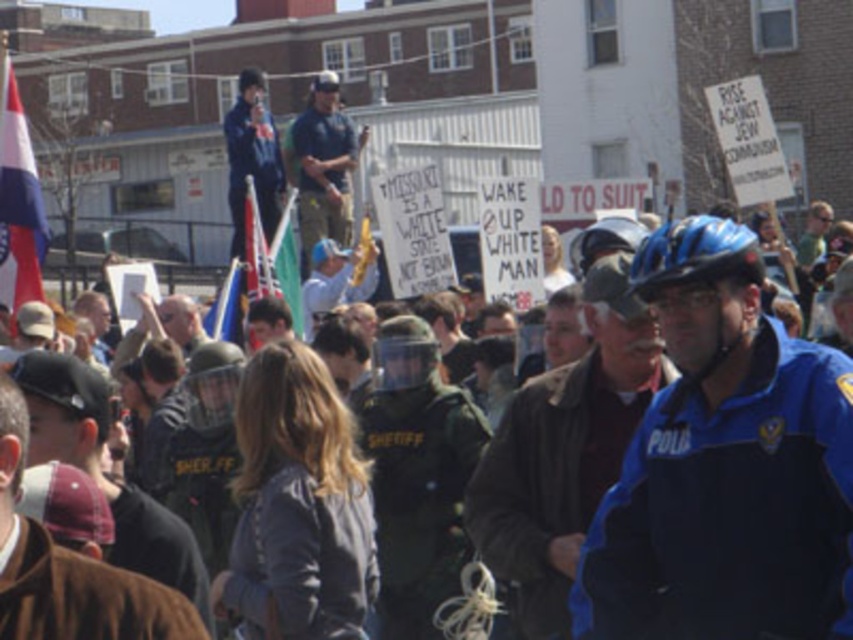
Is blue uniformed officer at upper center shorter than blue matte bicycle helmet at center?

Incorrect, blue uniformed officer at upper center's height does not fall short of blue matte bicycle helmet at center's.

Between blue uniformed officer at upper center and blue matte bicycle helmet at center, which one is positioned lower?

blue matte bicycle helmet at center is lower down.

Is point (300, 177) positioned after point (714, 259)?

Yes, it is.

Where is `blue uniformed officer at upper center`? This screenshot has height=640, width=853. blue uniformed officer at upper center is located at coordinates (322, 164).

Is the position of blue hardshell helmet at right less distant than that of tri-color fabric flag at upper left?

Yes, blue hardshell helmet at right is in front of tri-color fabric flag at upper left.

Can you confirm if blue hardshell helmet at right is smaller than tri-color fabric flag at upper left?

Indeed, blue hardshell helmet at right has a smaller size compared to tri-color fabric flag at upper left.

Is point (682, 496) less distant than point (25, 164)?

Yes.

What are the coordinates of `blue hardshell helmet at right` in the screenshot? It's located at (724, 465).

At what (x,y) coordinates should I click in order to perform the action: click on blue hardshell helmet at right. Please return your answer as a coordinate pair (x, y). This screenshot has width=853, height=640. Looking at the image, I should click on (724, 465).

Can you confirm if blue hardshell helmet at right is smaller than blue uniformed officer at upper center?

Yes, blue hardshell helmet at right is smaller than blue uniformed officer at upper center.

Does point (708, 397) lie behind point (323, 236)?

No, (708, 397) is closer to viewer.

The height and width of the screenshot is (640, 853). I want to click on blue hardshell helmet at right, so click(724, 465).